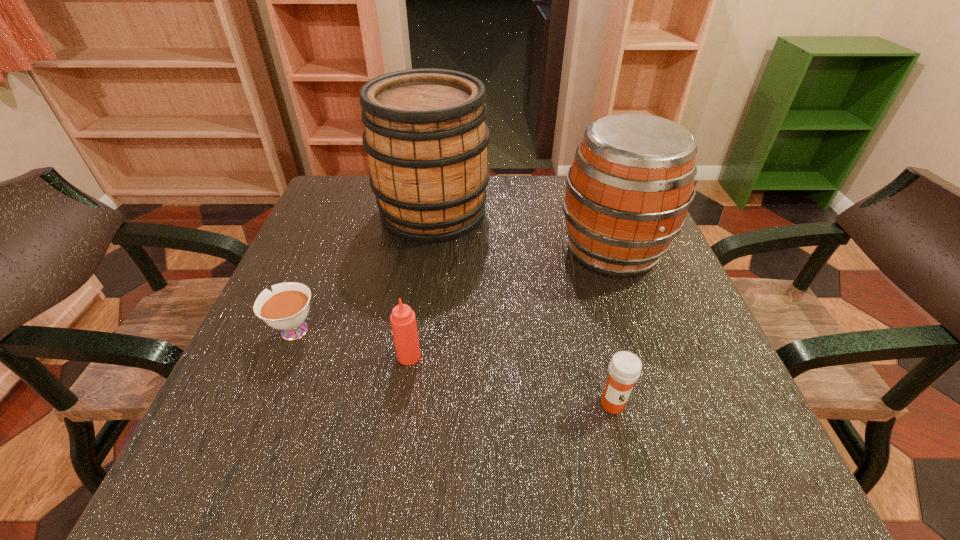
Where is `blank area located on the label side of the nearest object`? This screenshot has height=540, width=960. blank area located on the label side of the nearest object is located at coordinates (625, 454).

I want to click on cider situated at the left edge, so point(426,138).

Find the location of `teacup at the left edge`. teacup at the left edge is located at coordinates (286, 309).

The height and width of the screenshot is (540, 960). I want to click on object that is at the right edge, so click(x=629, y=189).

You are a GUI agent. You are given a task and a screenshot of the screen. Output one action in this format:
    pyautogui.click(x=<x>, y=<y>)
    Task: Click on the object that is at the far left corner
    The height and width of the screenshot is (540, 960).
    Given the screenshot: What is the action you would take?
    pyautogui.click(x=426, y=138)

This screenshot has height=540, width=960. I want to click on object situated at the far right corner, so click(x=629, y=189).

In the image, there is a desktop. Where is `vacant space at the far edge`? The height and width of the screenshot is (540, 960). vacant space at the far edge is located at coordinates (565, 180).

Locate an element on the screen. Image resolution: width=960 pixels, height=540 pixels. free space at the near edge of the desktop is located at coordinates tap(498, 442).

Identify the location of blank space at the left edge of the desktop. The height and width of the screenshot is (540, 960). (285, 402).

This screenshot has height=540, width=960. Identify the location of vacant space at the right edge. (674, 266).